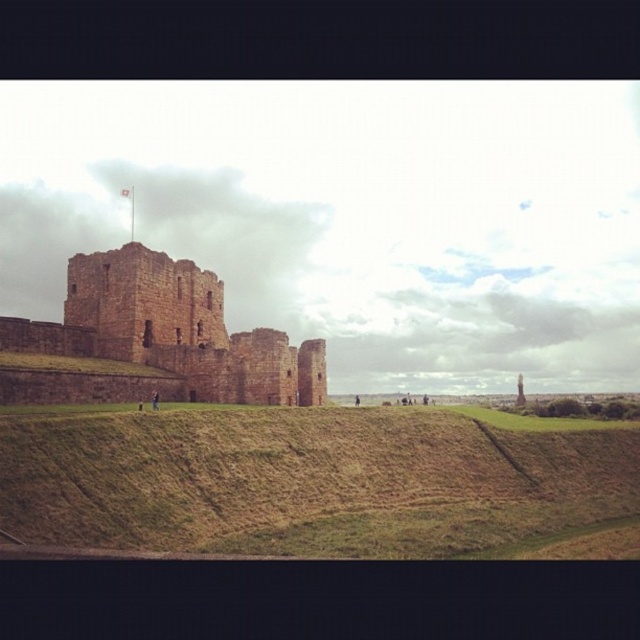
Question: Among these objects, which one is nearest to the camera?

Choices:
 (A) brown grassy hill at lower center
 (B) brown stone castle at center

Answer: (A)

Question: Is brown grassy hill at lower center thinner than brown stone castle at center?

Choices:
 (A) no
 (B) yes

Answer: (A)

Question: Among these objects, which one is farthest from the camera?

Choices:
 (A) brown stone castle at center
 (B) brown grassy hill at lower center

Answer: (A)

Question: Which of the following is the farthest from the observer?

Choices:
 (A) brown grassy hill at lower center
 (B) brown stone castle at center

Answer: (B)

Question: Does brown grassy hill at lower center have a larger size compared to brown stone castle at center?

Choices:
 (A) yes
 (B) no

Answer: (A)

Question: Does brown grassy hill at lower center have a larger size compared to brown stone castle at center?

Choices:
 (A) yes
 (B) no

Answer: (A)